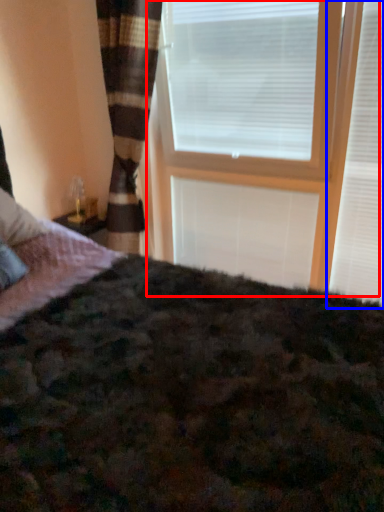
Question: Among these objects, which one is nearest to the camera, window frame (highlighted by a red box) or window blind (highlighted by a blue box)?

Choices:
 (A) window frame
 (B) window blind

Answer: (A)